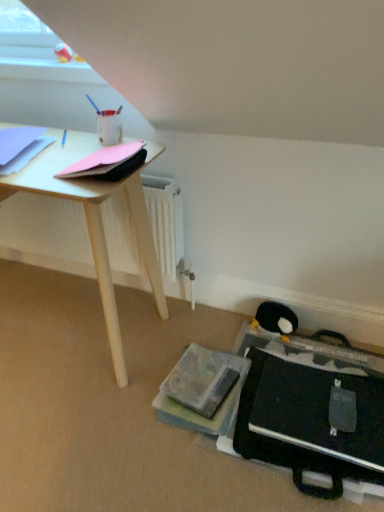
Question: Is black plush penguin at lower right to the right of pink matte paper at upper left, which is the 2th paperback book from left to right, from the viewer's perspective?

Choices:
 (A) yes
 (B) no

Answer: (A)

Question: Is black plush penguin at lower right touching pink matte paper at upper left, which appears as the 1th paperback book when viewed from the right?

Choices:
 (A) yes
 (B) no

Answer: (B)

Question: Is black plush penguin at lower right bigger than pink matte paper at upper left, which appears as the 1th paperback book when viewed from the right?

Choices:
 (A) yes
 (B) no

Answer: (B)

Question: Could you tell me if black plush penguin at lower right is facing pink matte paper at upper left, which appears as the 1th paperback book when viewed from the right?

Choices:
 (A) no
 (B) yes

Answer: (A)

Question: Can you confirm if black plush penguin at lower right is smaller than pink matte paper at upper left, which is the 2th paperback book from left to right?

Choices:
 (A) no
 (B) yes

Answer: (B)

Question: Is black plush penguin at lower right at the left side of pink matte paper at upper left, which is the 2th paperback book from left to right?

Choices:
 (A) yes
 (B) no

Answer: (B)

Question: Is pink matte paper at upper left, which appears as the 1th paperback book when viewed from the right, facing away from light blue paper at upper left, which is counted as the second paperback book, starting from the right?

Choices:
 (A) yes
 (B) no

Answer: (B)

Question: Is pink matte paper at upper left, which is the 2th paperback book from left to right, positioned beyond the bounds of light blue paper at upper left, which is the 1th paperback book in left-to-right order?

Choices:
 (A) no
 (B) yes

Answer: (B)

Question: Is pink matte paper at upper left, which appears as the 1th paperback book when viewed from the right, bigger than light blue paper at upper left, which is the 1th paperback book in left-to-right order?

Choices:
 (A) no
 (B) yes

Answer: (A)

Question: Is pink matte paper at upper left, which appears as the 1th paperback book when viewed from the right, next to light blue paper at upper left, which is the 1th paperback book in left-to-right order, and touching it?

Choices:
 (A) yes
 (B) no

Answer: (B)

Question: Is pink matte paper at upper left, which is the 2th paperback book from left to right, closer to camera compared to light blue paper at upper left, which is the 1th paperback book in left-to-right order?

Choices:
 (A) no
 (B) yes

Answer: (B)

Question: Does pink matte paper at upper left, which is the 2th paperback book from left to right, appear on the right side of light blue paper at upper left, which is the 1th paperback book in left-to-right order?

Choices:
 (A) no
 (B) yes

Answer: (B)

Question: Considering the relative positions of light blue paper at upper left, which is counted as the second paperback book, starting from the right, and pink matte paper at upper left, which appears as the 1th paperback book when viewed from the right, in the image provided, is light blue paper at upper left, which is counted as the second paperback book, starting from the right, to the right of pink matte paper at upper left, which appears as the 1th paperback book when viewed from the right, from the viewer's perspective?

Choices:
 (A) no
 (B) yes

Answer: (A)